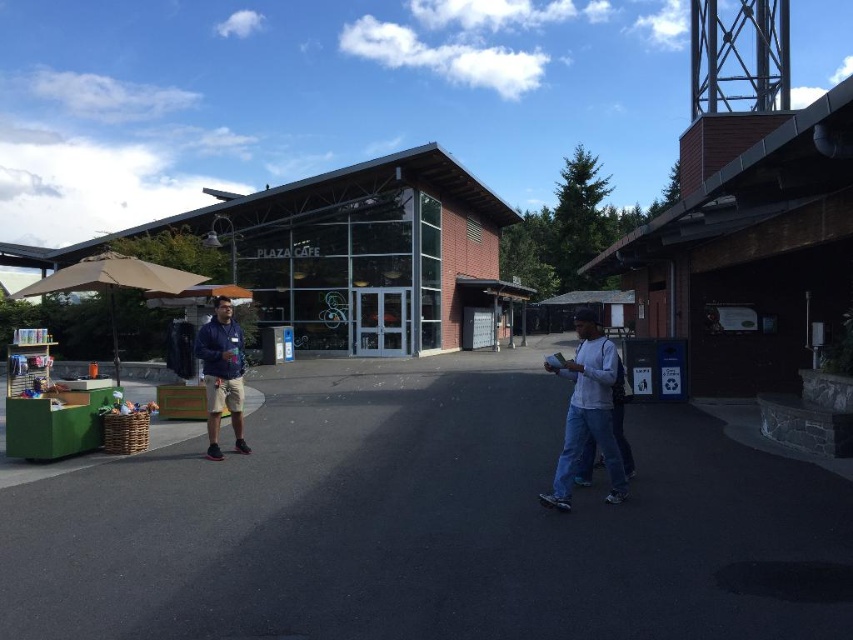
You are a photographer standing in the plaza and you see the white matte shirt at center and the navy blue jacket at center. Which one is positioned to the right side from your viewpoint?

The white matte shirt at center is positioned to the right of the navy blue jacket at center.

You are a photographer wanting to capture both the navy blue jacket at center and the tan fabric umbrella at left in a single frame. Given that your camera can only focus on objects wider than 1 meter, will both objects meet the focus requirement?

The navy blue jacket at center has a width less than the tan fabric umbrella at left. Since the camera requires objects wider than 1 meter, we need to check both widths. However, since the jacket is narrower than the umbrella, if the umbrella is wider than 1 meter, the jacket might not be. Without exact measurements, we can only confirm the umbrella potentially meets the requirement, but the jacket may not. However, the description only states their relative sizes, not absolute. Thus, it is uncertain if the

You are standing at the origin point in the scene. Where is the white matte shirt at center located in terms of coordinates?

The white matte shirt at center is located at coordinates approximately 0.645 on the x axis and 0.689 on the y axis.